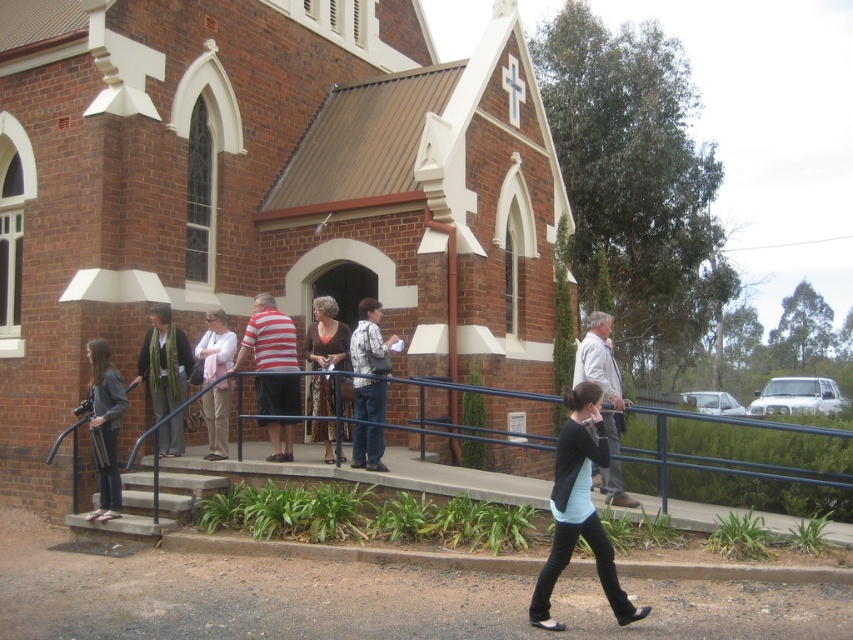
Question: Among these points, which one is farthest from the camera?

Choices:
 (A) (102, 403)
 (B) (186, 394)
 (C) (532, 492)

Answer: (B)

Question: Observing the image, what is the correct spatial positioning of striped cotton shirt at center in reference to white printed shirt at center?

Choices:
 (A) left
 (B) right

Answer: (A)

Question: Does green scarf at left have a smaller size compared to brown textured dress at center?

Choices:
 (A) yes
 (B) no

Answer: (A)

Question: Can you confirm if black metal railing at lower center is thinner than gray fabric jacket at center?

Choices:
 (A) no
 (B) yes

Answer: (A)

Question: Estimate the real-world distances between objects in this image. Which object is farther from the light blue fabric shirt at center?

Choices:
 (A) brick church at center
 (B) pink fabric shirt at center

Answer: (A)

Question: Which point appears farthest from the camera in this image?

Choices:
 (A) (610, 426)
 (B) (395, 340)
 (C) (109, 490)

Answer: (B)